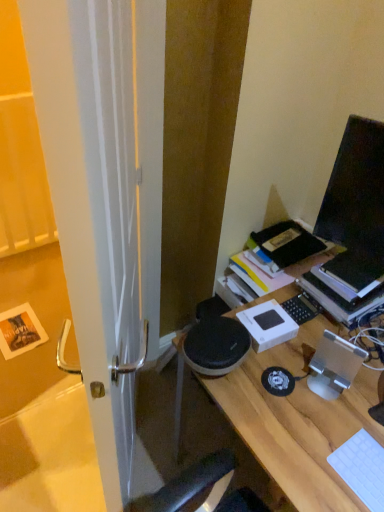
Locate an element on the screen. The height and width of the screenshot is (512, 384). vacant area on top of wooden desk at center (from a real-world perspective) is located at coordinates (329, 410).